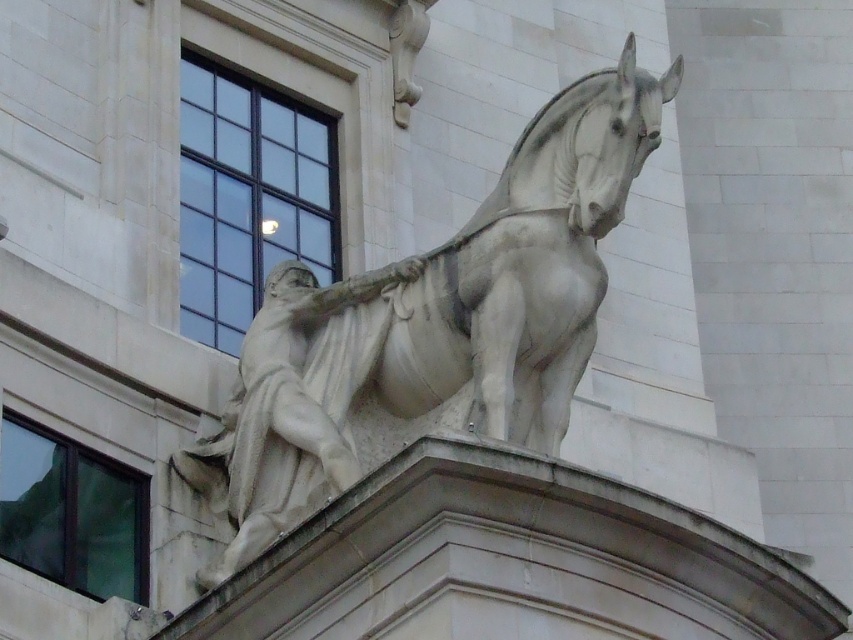
Question: Is white marble horse at upper center closer to camera compared to white marble statue at upper center?

Choices:
 (A) yes
 (B) no

Answer: (A)

Question: Which object appears farthest from the camera in this image?

Choices:
 (A) white marble statue at upper center
 (B) white marble horse at upper center

Answer: (A)

Question: Which object appears closest to the camera in this image?

Choices:
 (A) white marble horse at upper center
 (B) white marble statue at upper center

Answer: (A)

Question: Is white marble horse at upper center further to camera compared to white marble statue at upper center?

Choices:
 (A) yes
 (B) no

Answer: (B)

Question: Is white marble horse at upper center behind white marble statue at upper center?

Choices:
 (A) no
 (B) yes

Answer: (A)